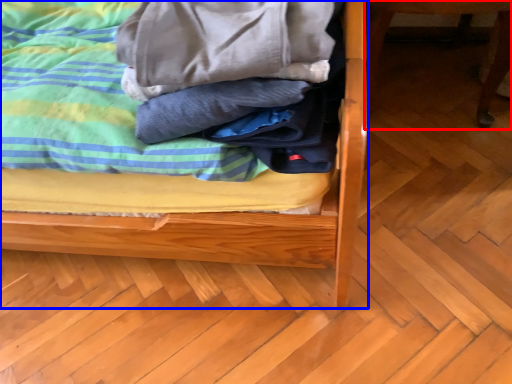
Question: Among these objects, which one is nearest to the camera, furniture (highlighted by a red box) or bed (highlighted by a blue box)?

Choices:
 (A) furniture
 (B) bed

Answer: (B)